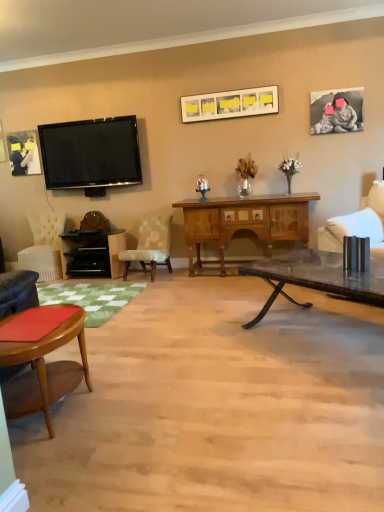
I want to click on vacant space that's between transparent glass coffee table at center and wooden oval chair at lower left, the 1th chair positioned from the front, so click(208, 377).